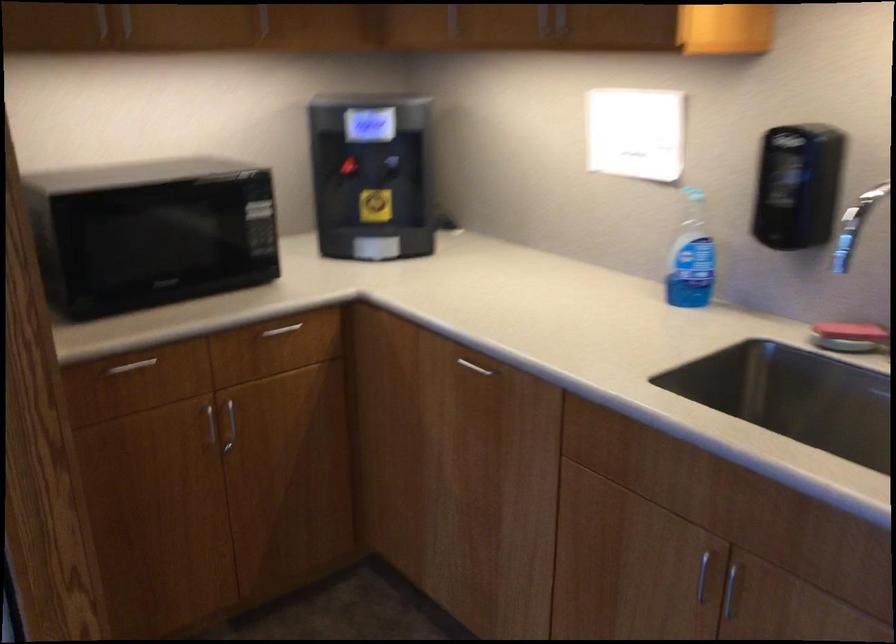
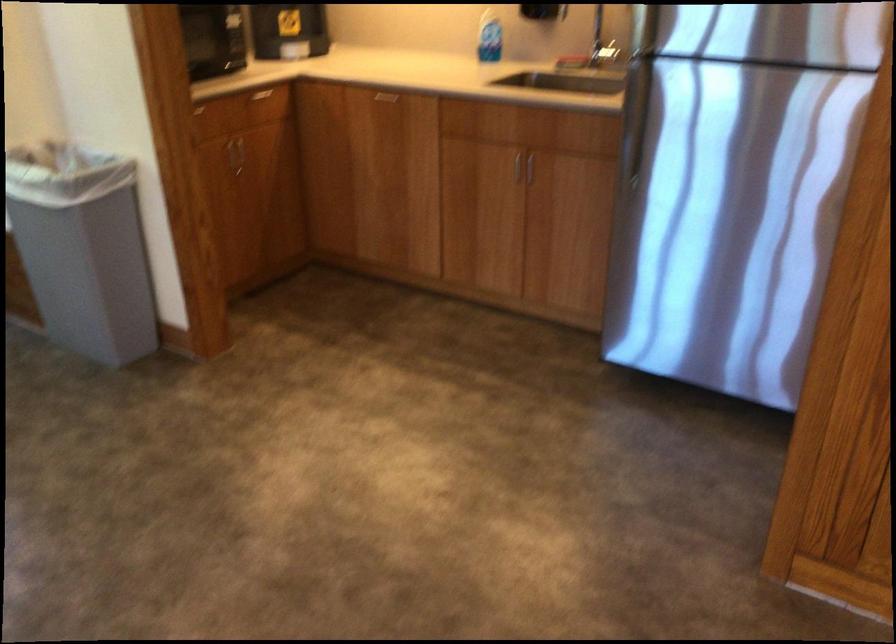
Find the pixel in the second image that matches the point at 222,422 in the first image.

(234, 153)